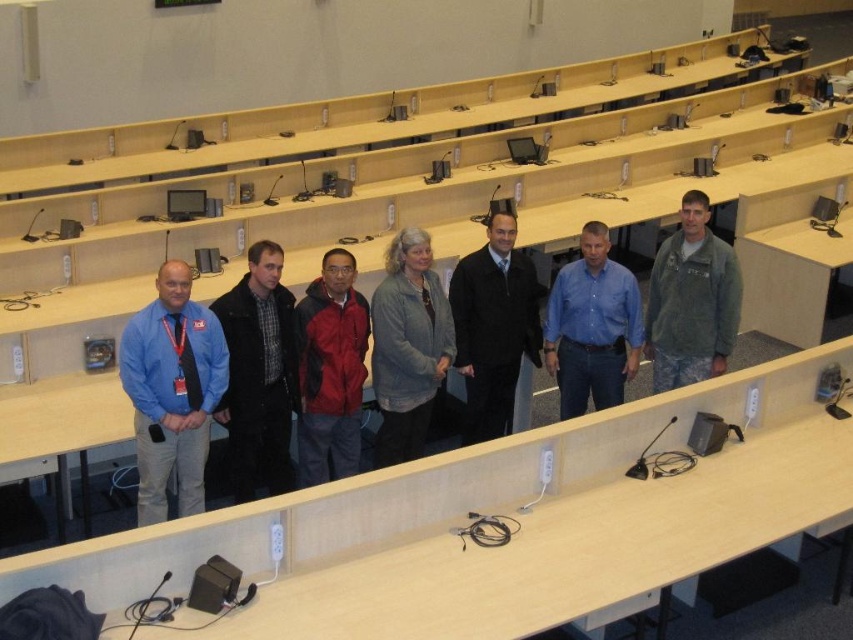
You are organizing a photo shoot and need to arrange the black matte jacket at center and the blue denim shirt at center in a way that highlights their height difference. Which one should be placed on a higher platform to make the height difference more noticeable?

The black matte jacket at center should be placed on a higher platform since it has a greater height compared to the blue denim shirt at center, making the height difference more noticeable.

You are standing at the entrance of the lecture hall and want to locate the person wearing the plaid fabric shirt at center. According to the coordinates provided, in which direction should you look to find them?

The plaid fabric shirt at center is located at coordinates point [258,374], so you should look towards the center of the image to find them.